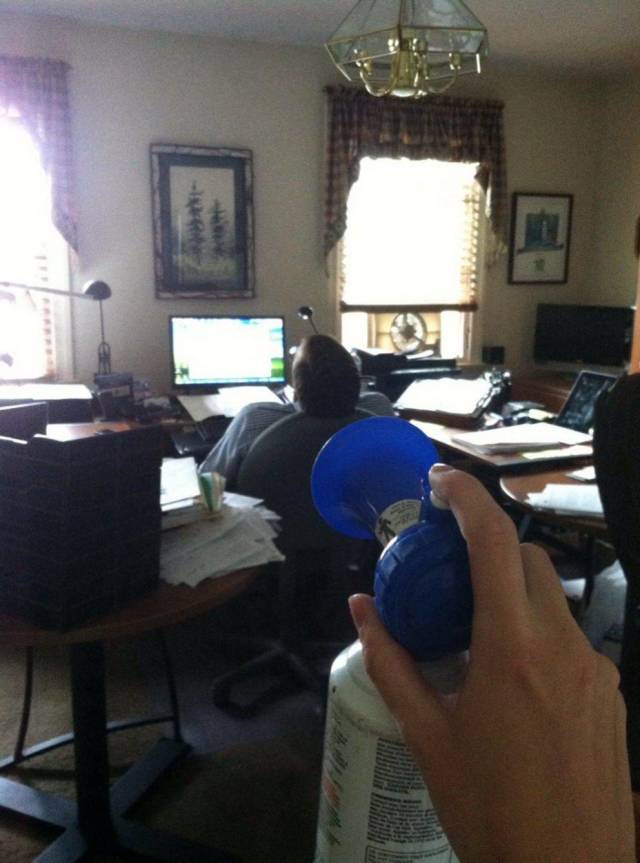
What are the coordinates of `keyboard` in the screenshot? It's located at (216, 427).